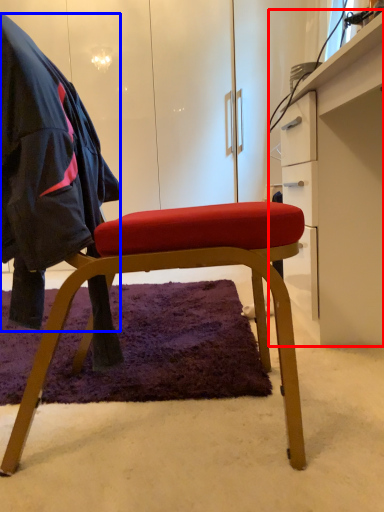
Question: Which of the following is the farthest to the observer, desk (highlighted by a red box) or cloak (highlighted by a blue box)?

Choices:
 (A) desk
 (B) cloak

Answer: (A)